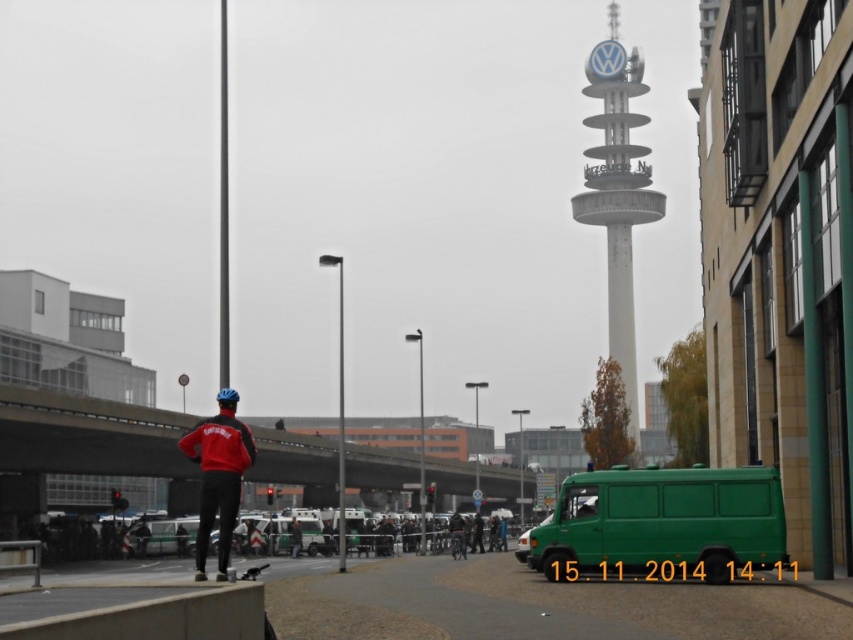
Question: Can you confirm if concrete bridge at center is bigger than white smooth tower at center?

Choices:
 (A) no
 (B) yes

Answer: (A)

Question: Considering the relative positions of white smooth tower at center and red matte jacket at lower left in the image provided, where is white smooth tower at center located with respect to red matte jacket at lower left?

Choices:
 (A) left
 (B) right

Answer: (B)

Question: Which point is closer to the camera taking this photo?

Choices:
 (A) (296, 552)
 (B) (32, 400)
 (C) (599, 196)
 (D) (210, 461)

Answer: (D)

Question: Among these objects, which one is farthest from the camera?

Choices:
 (A) red matte jacket at lower left
 (B) white smooth tower at center
 (C) dark blue helmet at center
 (D) concrete bridge at center

Answer: (B)

Question: Which of the following is the farthest from the observer?

Choices:
 (A) (486, 465)
 (B) (775, 508)
 (C) (227, 394)
 (D) (293, 516)

Answer: (A)

Question: Is concrete bridge at center below green matte van at lower right?

Choices:
 (A) no
 (B) yes

Answer: (B)